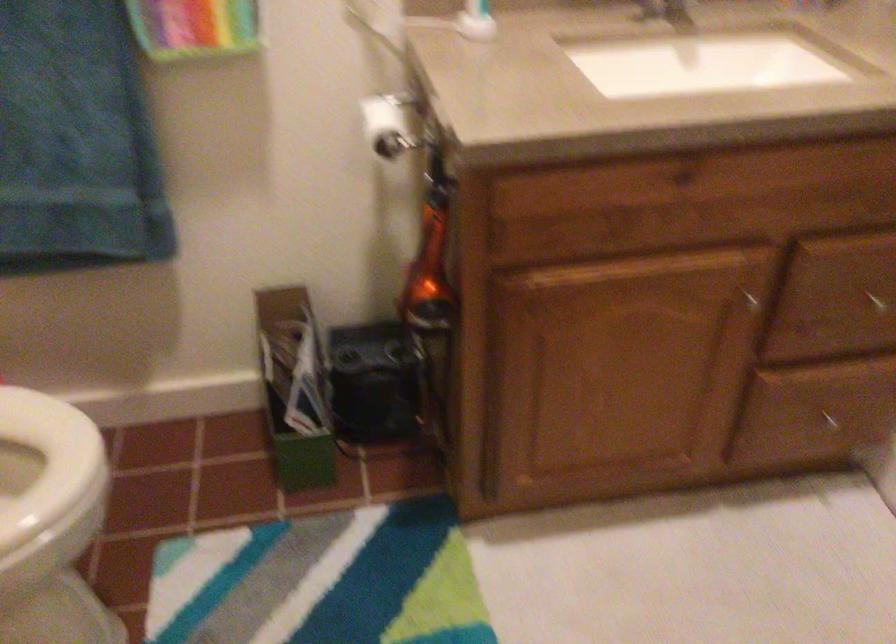
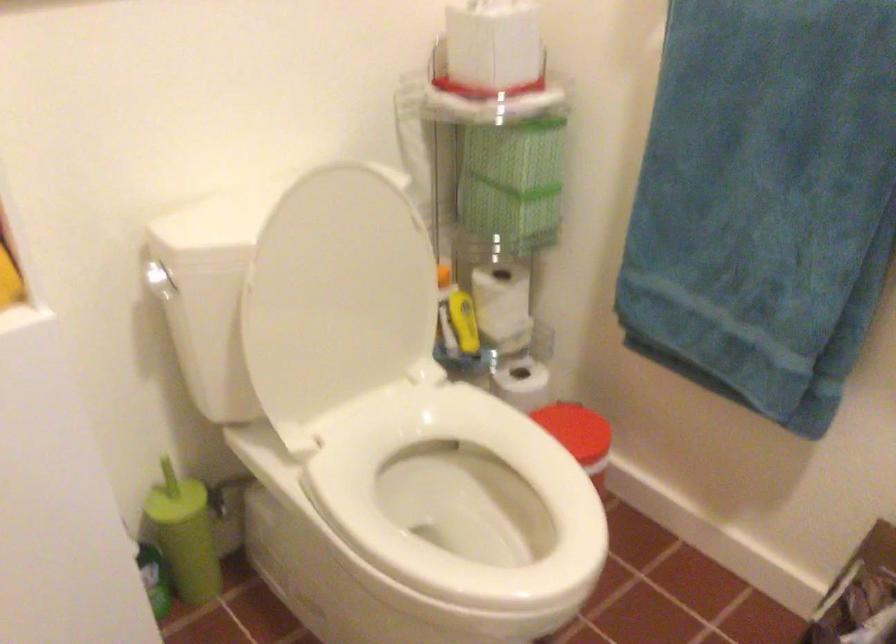
Question: The first image is from the beginning of the video and the second image is from the end. How did the camera likely rotate when shooting the video?

Choices:
 (A) Left
 (B) Right
 (C) Up
 (D) Down

Answer: (A)